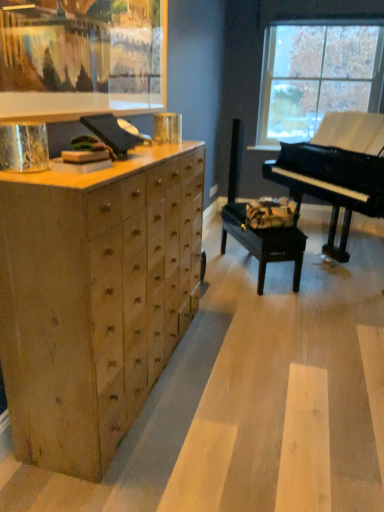
Question: Does point (269, 246) appear closer or farther from the camera than point (31, 305)?

Choices:
 (A) farther
 (B) closer

Answer: (A)

Question: From the image's perspective, is black wood music stool at center located above or below natural wood chest of drawers at left?

Choices:
 (A) below
 (B) above

Answer: (B)

Question: Which is farther from the black polished piano at right?

Choices:
 (A) natural wood chest of drawers at left
 (B) black wood music stool at center
 (C) wooden picture frame at upper left
 (D) transparent glass window at upper right

Answer: (A)

Question: Estimate the real-world distances between objects in this image. Which object is farther from the wooden picture frame at upper left?

Choices:
 (A) black wood music stool at center
 (B) black polished piano at right
 (C) natural wood chest of drawers at left
 (D) transparent glass window at upper right

Answer: (D)